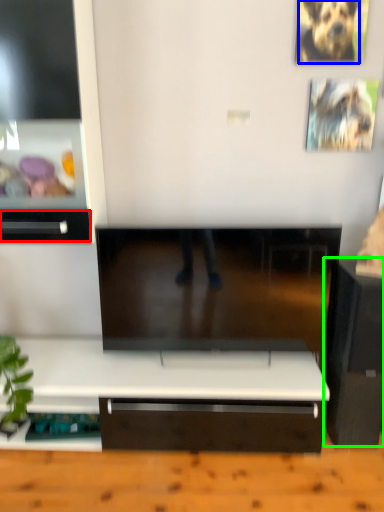
Question: Based on their relative distances, which object is nearer to drawer (highlighted by a red box)? Choose from animal (highlighted by a blue box) and furniture (highlighted by a green box).

Choices:
 (A) animal
 (B) furniture

Answer: (B)